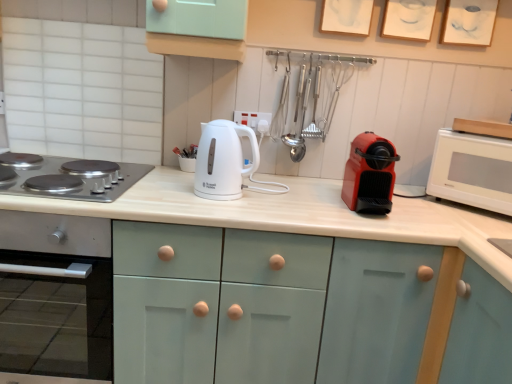
In order to click on vacant position to the left of white glossy microwave at right in this screenshot , I will do `click(419, 210)`.